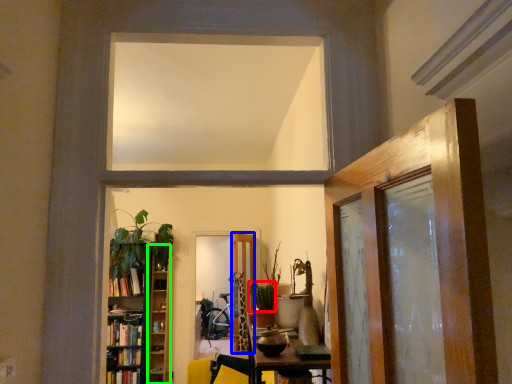
Question: Estimate the real-world distances between objects in this image. Which object is farther from plant (highlighted by a red box), door (highlighted by a blue box) or shelf (highlighted by a green box)?

Choices:
 (A) door
 (B) shelf

Answer: (B)